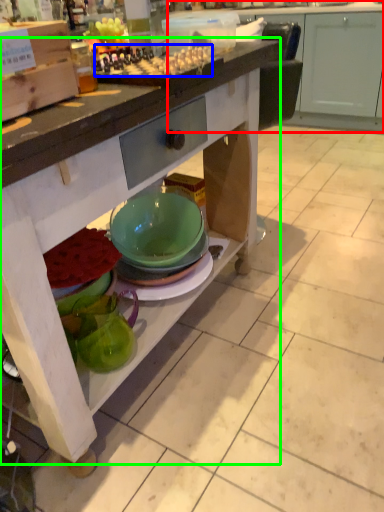
Question: Estimate the real-world distances between objects in this image. Which object is farther from cabinetry (highlighted by a red box), food (highlighted by a blue box) or table (highlighted by a green box)?

Choices:
 (A) food
 (B) table

Answer: (A)